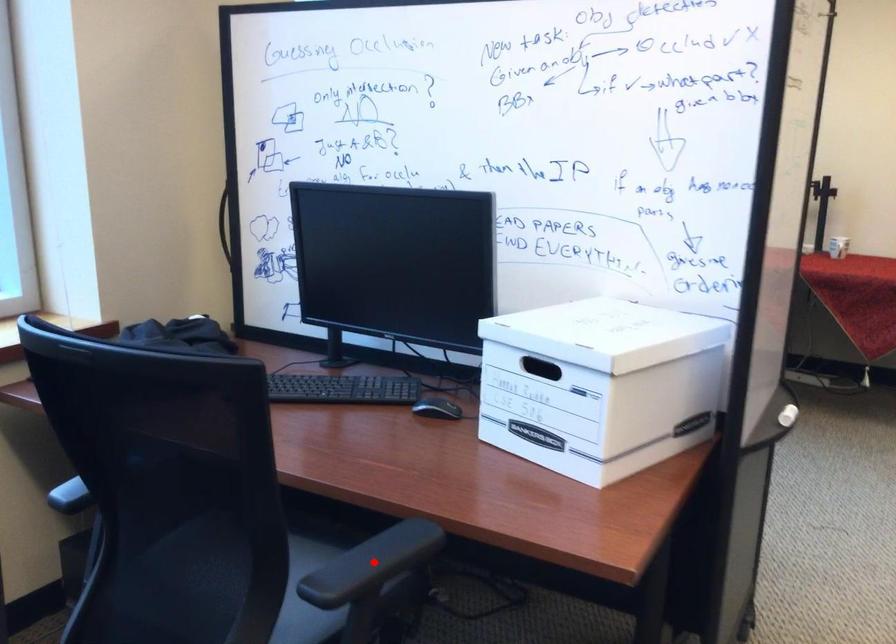
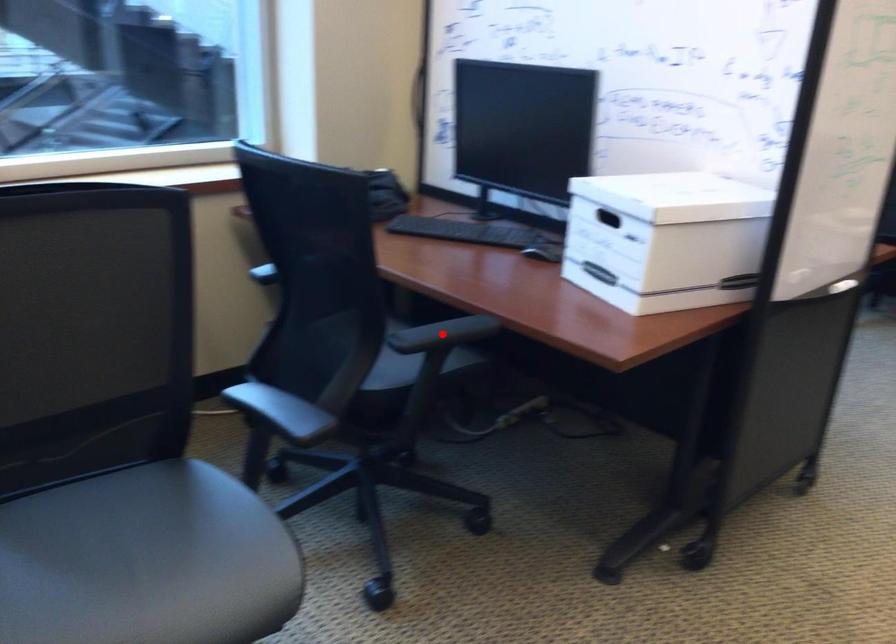
I am providing you with two images of the same scene from different viewpoints. A red point is marked on the first image and another point is marked on the second image. Do the highlighted points in image1 and image2 indicate the same real-world spot?

Yes